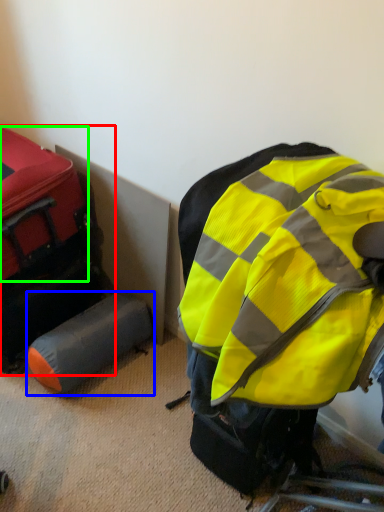
Question: Which is nearer to the luggage and bags (highlighted by a red box)? luggage (highlighted by a blue box) or luggage (highlighted by a green box).

Choices:
 (A) luggage
 (B) luggage

Answer: (B)